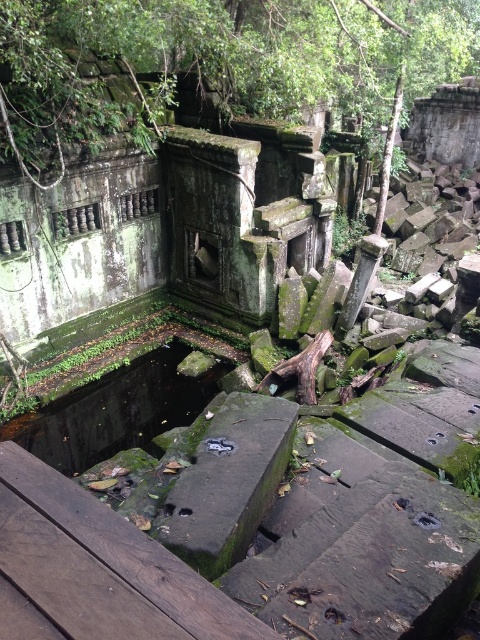
Which is above, brown wooden plank at lower left or green mossy stone at center?

brown wooden plank at lower left is above.

Is brown wooden plank at lower left behind green mossy stone at center?

No, brown wooden plank at lower left is in front of green mossy stone at center.

Does point (72, 506) come behind point (170, 401)?

No, it is in front of (170, 401).

Where is `brown wooden plank at lower left`? The image size is (480, 640). brown wooden plank at lower left is located at coordinates (96, 570).

From the picture: Which is above, green mossy stone at upper center or green mossy stone at center?

green mossy stone at upper center

Measure the distance between green mossy stone at upper center and camera.

green mossy stone at upper center is 17.93 feet from camera.

Where is `green mossy stone at upper center`? green mossy stone at upper center is located at coordinates (220, 60).

Does green mossy stone at upper center have a larger size compared to brown wooden plank at lower left?

Indeed, green mossy stone at upper center has a larger size compared to brown wooden plank at lower left.

Does green mossy stone at upper center have a greater height compared to brown wooden plank at lower left?

Yes, green mossy stone at upper center is taller than brown wooden plank at lower left.

Find the location of `green mossy stone at upper center`. green mossy stone at upper center is located at coordinates (220, 60).